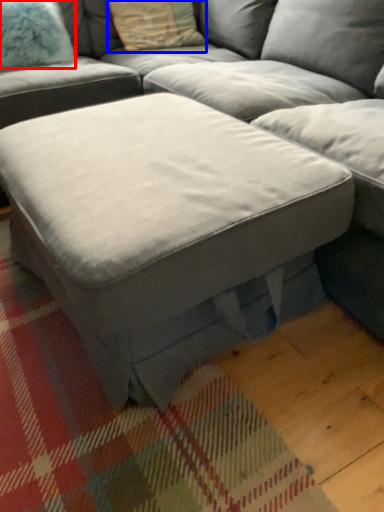
Question: Which of the following is the closest to the observer, pillow (highlighted by a red box) or pillow (highlighted by a blue box)?

Choices:
 (A) pillow
 (B) pillow

Answer: (A)